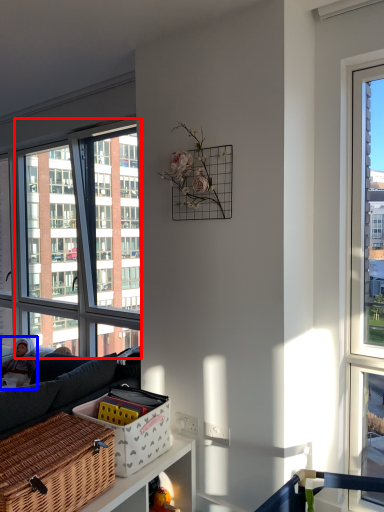
Question: Among these objects, which one is farthest to the camera, window (highlighted by a red box) or couple (highlighted by a blue box)?

Choices:
 (A) window
 (B) couple

Answer: (B)